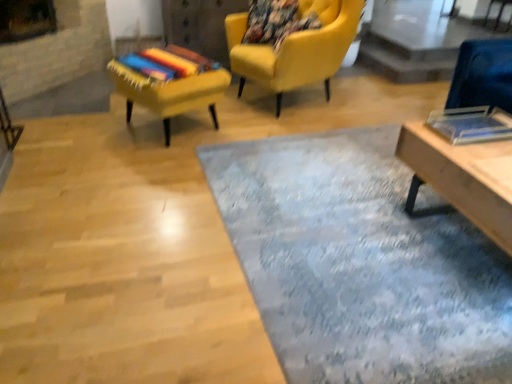
Question: From a real-world perspective, is textured blue rug at center physically located above or below transparent glass table at upper right?

Choices:
 (A) below
 (B) above

Answer: (A)

Question: Looking at their shapes, would you say textured blue rug at center is wider or thinner than transparent glass table at upper right?

Choices:
 (A) wide
 (B) thin

Answer: (A)

Question: Estimate the real-world distances between objects in this image. Which object is farther from the wooden table at lower right?

Choices:
 (A) textured blue rug at center
 (B) matte yellow armchair at upper center, arranged as the first chair when viewed from the right
 (C) transparent glass table at upper right
 (D) textured yellow chair at upper left, which appears as the 2th chair when viewed from the right

Answer: (C)

Question: Which object is positioned closest to the textured yellow chair at upper left, which appears as the 2th chair when viewed from the right?

Choices:
 (A) textured blue rug at center
 (B) transparent glass table at upper right
 (C) matte yellow armchair at upper center, acting as the 2th chair starting from the left
 (D) wooden table at lower right

Answer: (C)